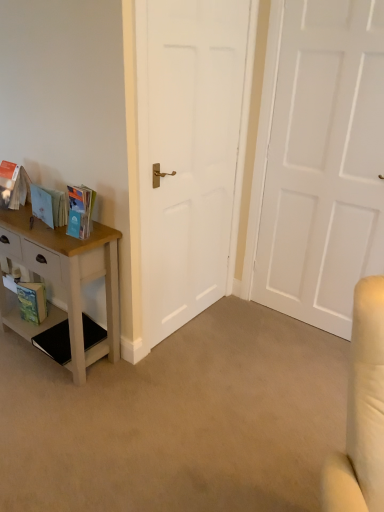
Where is `free spot in front of matte cardboard book at left, the second book viewed from the left`? free spot in front of matte cardboard book at left, the second book viewed from the left is located at coordinates (45, 233).